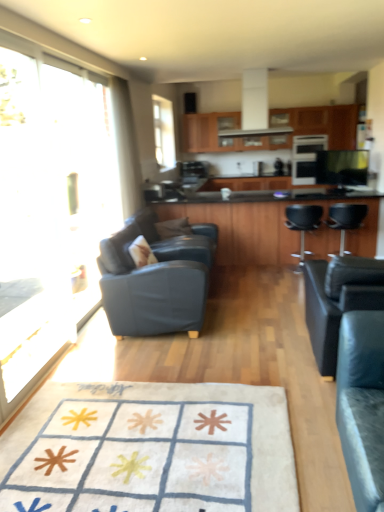
Question: Considering the relative sizes of transparent glass window at upper center and black glossy tv at upper right, the 1th appliance ordered from the bottom, in the image provided, is transparent glass window at upper center shorter than black glossy tv at upper right, the 1th appliance ordered from the bottom,?

Choices:
 (A) yes
 (B) no

Answer: (B)

Question: Is transparent glass window at upper center bigger than black glossy tv at upper right, the 2th appliance in the top-to-bottom sequence?

Choices:
 (A) no
 (B) yes

Answer: (A)

Question: Is transparent glass window at upper center aimed at black glossy tv at upper right, the 2th appliance in the top-to-bottom sequence?

Choices:
 (A) no
 (B) yes

Answer: (A)

Question: From the image's perspective, is transparent glass window at upper center on black glossy tv at upper right, the 1th appliance ordered from the bottom?

Choices:
 (A) yes
 (B) no

Answer: (A)

Question: Would you say transparent glass window at upper center contains black glossy tv at upper right, the 1th appliance ordered from the bottom?

Choices:
 (A) yes
 (B) no

Answer: (B)

Question: In terms of width, does transparent glass door at left look wider or thinner when compared to wooden cabinets at upper center?

Choices:
 (A) wide
 (B) thin

Answer: (B)

Question: Would you say transparent glass door at left is to the left or to the right of wooden cabinets at upper center in the picture?

Choices:
 (A) left
 (B) right

Answer: (A)

Question: From a real-world perspective, is transparent glass door at left physically located above or below wooden cabinets at upper center?

Choices:
 (A) above
 (B) below

Answer: (B)

Question: Considering the positions of transparent glass door at left and wooden cabinets at upper center in the image, is transparent glass door at left taller or shorter than wooden cabinets at upper center?

Choices:
 (A) tall
 (B) short

Answer: (A)

Question: In terms of height, does matte blue leather chair at left, arranged as the first chair when viewed from the left, look taller or shorter compared to white glossy exhaust hood at upper center?

Choices:
 (A) short
 (B) tall

Answer: (B)

Question: Based on their sizes in the image, would you say matte blue leather chair at left, which is the fourth chair in right-to-left order, is bigger or smaller than white glossy exhaust hood at upper center?

Choices:
 (A) big
 (B) small

Answer: (A)

Question: From the image's perspective, is matte blue leather chair at left, arranged as the first chair when viewed from the left, located above or below white glossy exhaust hood at upper center?

Choices:
 (A) below
 (B) above

Answer: (A)

Question: In the image, is matte blue leather chair at left, which is the fourth chair in right-to-left order, positioned in front of or behind white glossy exhaust hood at upper center?

Choices:
 (A) front
 (B) behind

Answer: (A)

Question: Is wooden cabinets at upper center wider or thinner than black laminate countertop at center?

Choices:
 (A) wide
 (B) thin

Answer: (B)

Question: Would you say wooden cabinets at upper center is to the left or to the right of black laminate countertop at center in the picture?

Choices:
 (A) left
 (B) right

Answer: (A)